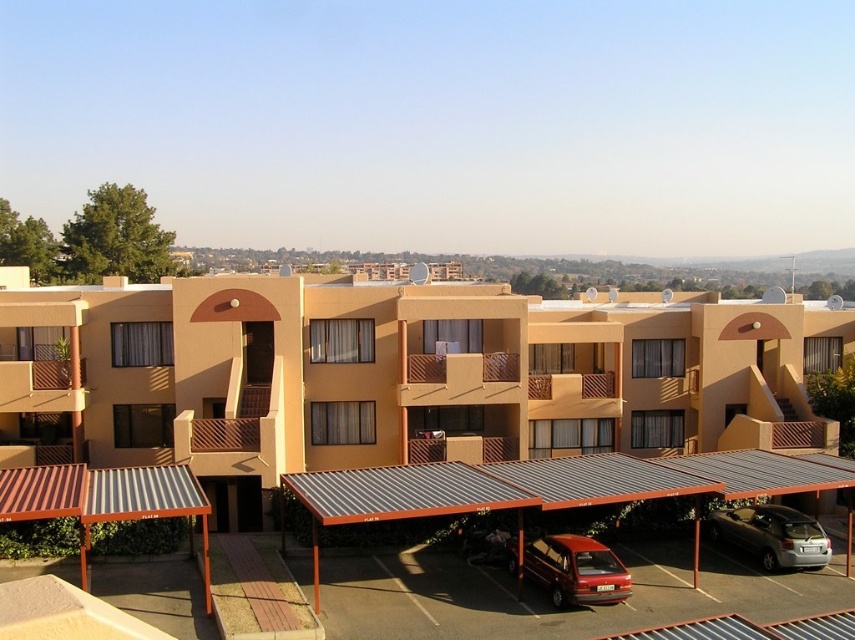
Who is more distant from viewer, (x=685, y=308) or (x=733, y=540)?

The point (x=685, y=308) is behind.

Is the position of matte brown awning at lower left less distant than that of silver metallic car at lower right?

No, matte brown awning at lower left is behind silver metallic car at lower right.

Find the location of a particular element. This screenshot has height=640, width=855. matte brown awning at lower left is located at coordinates (394, 376).

You are a GUI agent. You are given a task and a screenshot of the screen. Output one action in this format:
    pyautogui.click(x=<x>, y=<y>)
    Task: Click on the matte brown awning at lower left
    
    Given the screenshot: What is the action you would take?
    pyautogui.click(x=394, y=376)

What are the coordinates of `matte brown awning at lower left` in the screenshot? It's located at (394, 376).

What do you see at coordinates (394, 376) in the screenshot? I see `matte brown awning at lower left` at bounding box center [394, 376].

At what (x,y) coordinates should I click in order to perform the action: click on matte brown awning at lower left. Please return your answer as a coordinate pair (x, y). Looking at the image, I should click on (394, 376).

Who is shorter, metallic red hatchback at lower center or silver metallic car at lower right?

With less height is metallic red hatchback at lower center.

Which is more to the right, metallic red hatchback at lower center or silver metallic car at lower right?

silver metallic car at lower right is more to the right.

The image size is (855, 640). In order to click on metallic red hatchback at lower center in this screenshot , I will do `click(570, 570)`.

This screenshot has width=855, height=640. I want to click on metallic red hatchback at lower center, so click(570, 570).